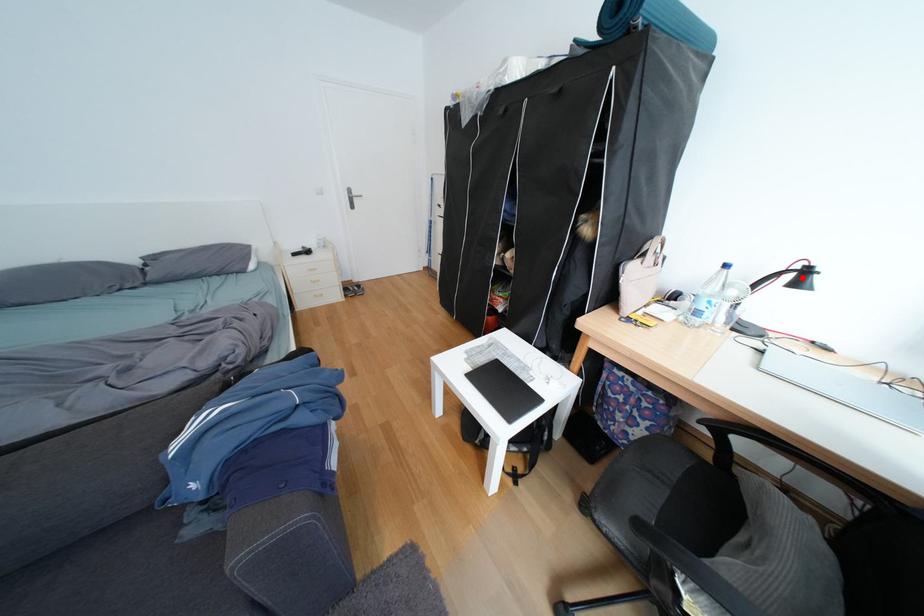
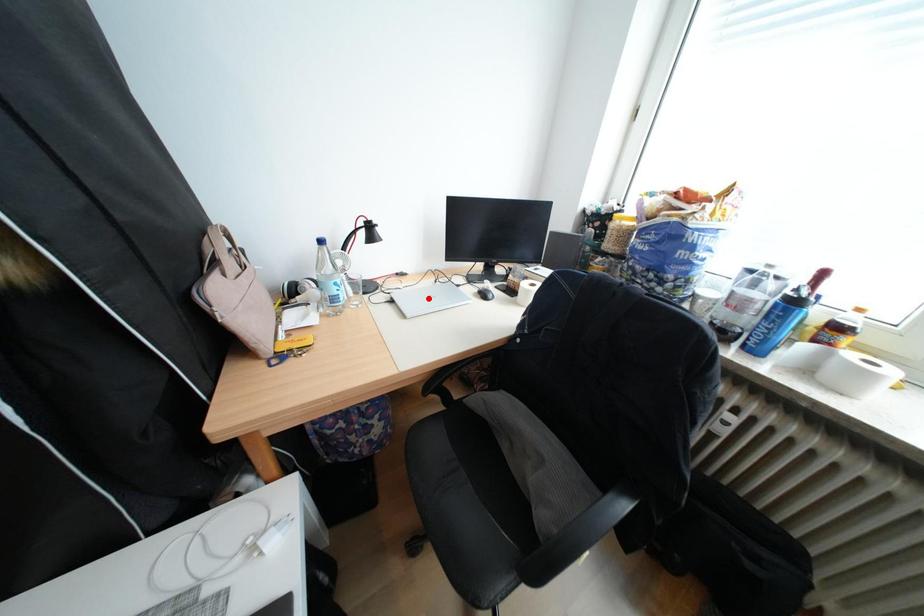
I am providing you with two images of the same scene from different viewpoints. A red point is marked on the first image and another point is marked on the second image. Is the marked point in image1 the same physical position as the marked point in image2?

No